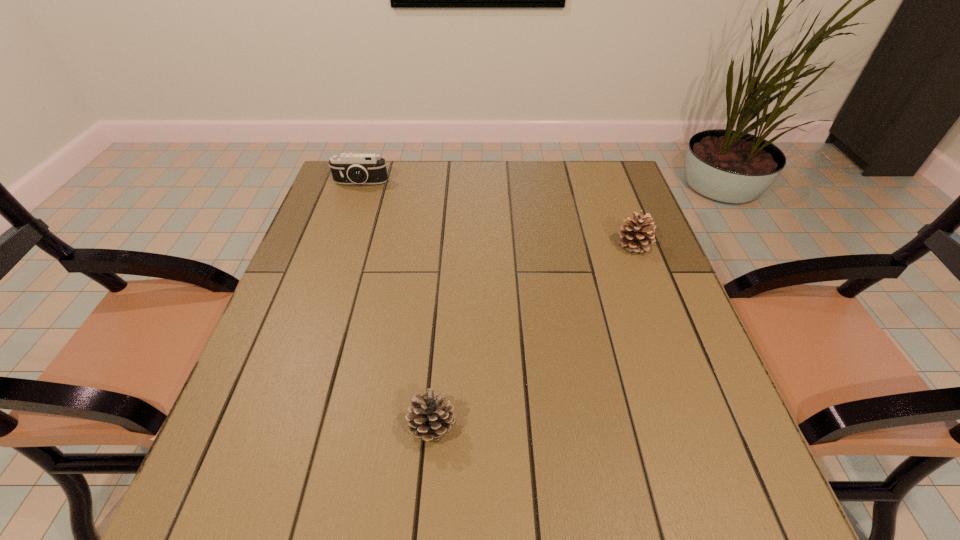
I want to click on object that can be found as the second closest to the farther pinecone, so click(350, 168).

Locate an element on the screen. Image resolution: width=960 pixels, height=540 pixels. vacant point that satisfies the following two spatial constraints: 1. on the front lens of the leftmost object; 2. on the right side of the rightmost object is located at coordinates (340, 245).

You are a GUI agent. You are given a task and a screenshot of the screen. Output one action in this format:
    pyautogui.click(x=<x>, y=<y>)
    Task: Click on the vacant space that satisfies the following two spatial constraints: 1. on the front lens of the left pinecone; 2. on the left side of the leftmost object
    The height and width of the screenshot is (540, 960).
    Given the screenshot: What is the action you would take?
    pyautogui.click(x=278, y=427)

Find the location of a particular element. The image size is (960, 540). free spot that satisfies the following two spatial constraints: 1. on the front lens of the camera; 2. on the right side of the right pinecone is located at coordinates (340, 245).

This screenshot has height=540, width=960. Find the location of `vacant space that satisfies the following two spatial constraints: 1. on the front lens of the farthest object; 2. on the left side of the second object from right to left`. vacant space that satisfies the following two spatial constraints: 1. on the front lens of the farthest object; 2. on the left side of the second object from right to left is located at coordinates (278, 427).

Locate an element on the screen. The height and width of the screenshot is (540, 960). blank space that satisfies the following two spatial constraints: 1. on the front lens of the second farthest object; 2. on the right side of the farthest object is located at coordinates (340, 245).

The width and height of the screenshot is (960, 540). What are the coordinates of `vacant space that satisfies the following two spatial constraints: 1. on the front lens of the second object from right to left; 2. on the left side of the farthest object` in the screenshot? It's located at (x=278, y=427).

Where is `vacant space that satisfies the following two spatial constraints: 1. on the front lens of the camera; 2. on the right side of the rightmost object`? vacant space that satisfies the following two spatial constraints: 1. on the front lens of the camera; 2. on the right side of the rightmost object is located at coordinates click(x=340, y=245).

Where is `free location that satisfies the following two spatial constraints: 1. on the front lens of the right pinecone; 2. on the left side of the camera`? This screenshot has height=540, width=960. free location that satisfies the following two spatial constraints: 1. on the front lens of the right pinecone; 2. on the left side of the camera is located at coordinates (340, 245).

Locate an element on the screen. The image size is (960, 540). free location that satisfies the following two spatial constraints: 1. on the front lens of the nearer pinecone; 2. on the left side of the leftmost object is located at coordinates (278, 427).